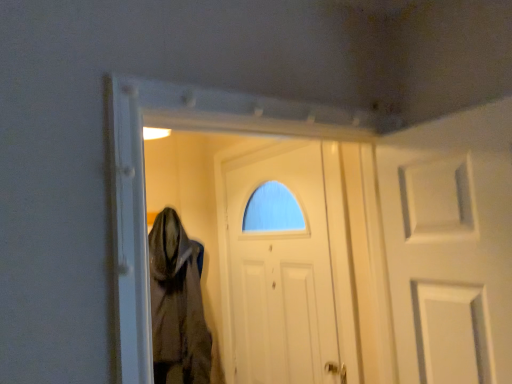
Image resolution: width=512 pixels, height=384 pixels. What do you see at coordinates (177, 304) in the screenshot?
I see `brown textured cloth at center` at bounding box center [177, 304].

The image size is (512, 384). I want to click on brown textured cloth at center, so [177, 304].

What is the approximate width of brown textured cloth at center?

It is 12.92 inches.

Measure the distance between point (155, 251) and camera.

Point (155, 251) is 6.91 feet away from camera.

What do you see at coordinates (280, 266) in the screenshot?
I see `white matte door at center` at bounding box center [280, 266].

Where is `white matte door at center`? The image size is (512, 384). white matte door at center is located at coordinates (280, 266).

The width and height of the screenshot is (512, 384). What are the coordinates of `brown textured cloth at center` in the screenshot? It's located at (177, 304).

Visually, is brown textured cloth at center positioned to the left or to the right of white matte door at center?

From the image, it's evident that brown textured cloth at center is to the left of white matte door at center.

Considering their positions, is brown textured cloth at center located in front of or behind white matte door at center?

brown textured cloth at center is positioned farther from the viewer than white matte door at center.

Is point (151, 294) closer to viewer compared to point (291, 193)?

No.

From the image's perspective, between brown textured cloth at center and white matte door at center, who is located below?

brown textured cloth at center.

From a real-world perspective, who is located higher, brown textured cloth at center or white matte door at center?

white matte door at center is physically above.

Does brown textured cloth at center have a lesser width compared to white matte door at center?

No.

Who is taller, brown textured cloth at center or white matte door at center?

white matte door at center.

From the picture: Which of these two, brown textured cloth at center or white matte door at center, is bigger?

Bigger between the two is white matte door at center.

Is brown textured cloth at center inside the boundaries of white matte door at center, or outside?

brown textured cloth at center is located beyond the bounds of white matte door at center.

Is brown textured cloth at center not close to white matte door at center?

Actually, brown textured cloth at center and white matte door at center are a little close together.

Could you tell me if brown textured cloth at center is facing white matte door at center?

No.

Identify the location of door located above the brown textured cloth at center (from a real-world perspective). click(280, 266).

Based on the photo, in the image, is white matte door at center on the left side or the right side of brown textured cloth at center?

From the image, it's evident that white matte door at center is to the right of brown textured cloth at center.

Which object is closer to the camera taking this photo, white matte door at center or brown textured cloth at center?

white matte door at center is more forward.

Is point (276, 370) farther from viewer compared to point (170, 305)?

No.

From the image's perspective, is white matte door at center located above or below brown textured cloth at center?

Clearly, from the image's perspective, white matte door at center is above brown textured cloth at center.

From a real-world perspective, between white matte door at center and brown textured cloth at center, who is vertically lower?

From a 3D spatial view, brown textured cloth at center is below.

Which object is wider, white matte door at center or brown textured cloth at center?

With larger width is brown textured cloth at center.

Considering the relative sizes of white matte door at center and brown textured cloth at center in the image provided, is white matte door at center shorter than brown textured cloth at center?

Incorrect, the height of white matte door at center does not fall short of that of brown textured cloth at center.

In terms of size, does white matte door at center appear bigger or smaller than brown textured cloth at center?

white matte door at center is bigger than brown textured cloth at center.

Would you say brown textured cloth at center is part of white matte door at center's contents?

No, brown textured cloth at center is located outside of white matte door at center.

Can you see white matte door at center touching brown textured cloth at center?

There is a gap between white matte door at center and brown textured cloth at center.

Does white matte door at center turn towards brown textured cloth at center?

Yes, white matte door at center is turned towards brown textured cloth at center.

Can you tell me how much white matte door at center and brown textured cloth at center differ in facing direction?

89.9 degrees.

Where is `door in front of the brown textured cloth at center`? The height and width of the screenshot is (384, 512). door in front of the brown textured cloth at center is located at coordinates (280, 266).

Locate an element on the screen. This screenshot has height=384, width=512. cloak located behind the white matte door at center is located at coordinates (177, 304).

Where is `door positioned vertically above the brown textured cloth at center (from a real-world perspective)`? door positioned vertically above the brown textured cloth at center (from a real-world perspective) is located at coordinates (280, 266).